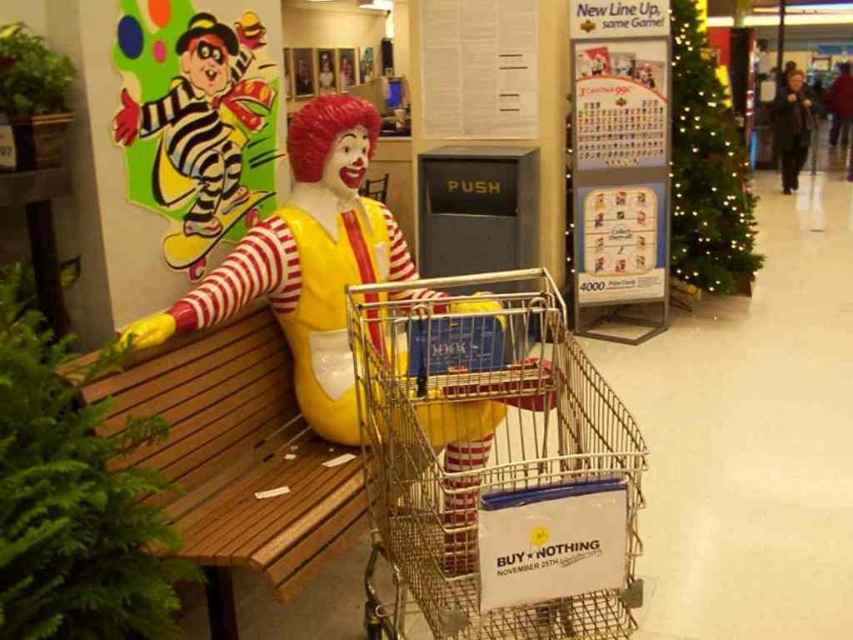
You are a customer in the store and want to reach an item on a high shelf. You see the colorful paper clown at upper left and the dark gray sweater at right. Which object is shorter and could potentially be used as a step stool?

The colorful paper clown at upper left is shorter than the dark gray sweater at right, so it could be used as a step stool.

You are a store employee who needs to place a new display between the wooden bench at left and the dark gray sweater at right. The display requires a minimum width of 1.2 meters. Can the space between them accommodate the display?

The wooden bench at left is wider than the dark gray sweater at right. However, the description only provides information about their widths, not the distance between them. Therefore, it is impossible to determine if the space between them can accommodate the display based on the given information.

You are standing at the entrance of the store and want to locate the wooden bench at left. According to the coordinates provided, where should you look to find it?

The wooden bench at left is located at coordinates point (x=236, y=458).